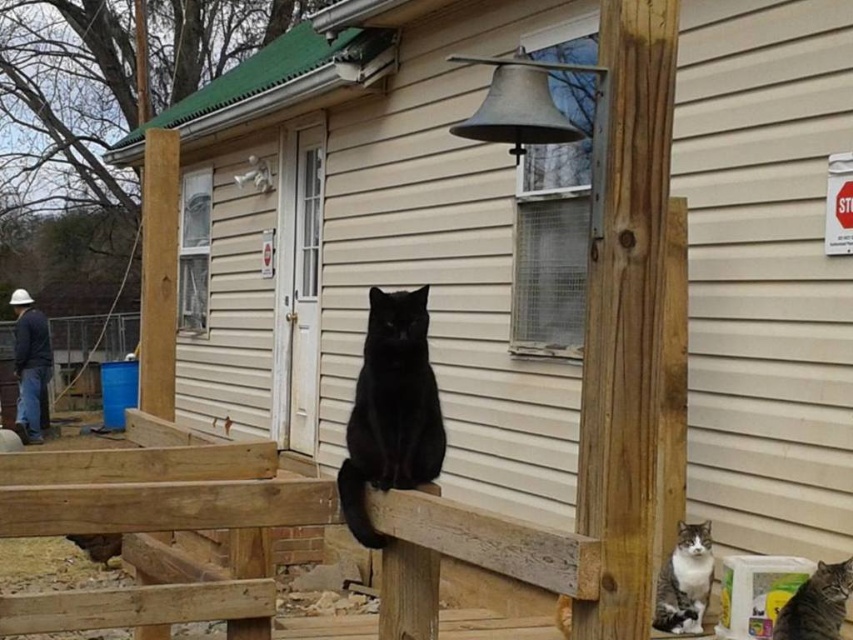
Between point (689, 588) and point (822, 588), which one is positioned behind?

The point (689, 588) is behind.

Identify the location of gray tabby cat at lower right. (685, 580).

Find the location of a particular element. The image size is (853, 640). gray tabby cat at lower right is located at coordinates (685, 580).

Which is below, black matte/solid cat at center or gray tabby cat at lower right?

gray tabby cat at lower right is lower down.

Does black matte/solid cat at center appear under gray tabby cat at lower right?

No.

Does point (358, 388) come closer to viewer compared to point (663, 596)?

That is True.

At what (x,y) coordinates should I click in order to perform the action: click on black matte/solid cat at center. Please return your answer as a coordinate pair (x, y). This screenshot has width=853, height=640. Looking at the image, I should click on (392, 410).

Is black matte/solid cat at center shorter than tabby fur cat at lower right?

Incorrect, black matte/solid cat at center's height does not fall short of tabby fur cat at lower right's.

Between point (376, 452) and point (816, 570), which one is positioned in front?

Point (376, 452) is more forward.

At what (x,y) coordinates should I click in order to perform the action: click on black matte/solid cat at center. Please return your answer as a coordinate pair (x, y). Looking at the image, I should click on (392, 410).